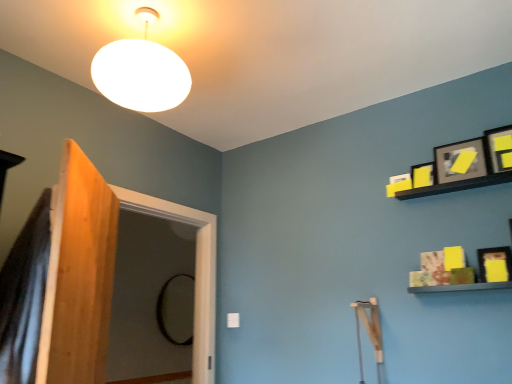
Question: Is matte black picture frame at upper right, which is counted as the 1th picture frame, starting from the top, at the back of matte black picture frame at upper right, the third picture frame in the bottom-to-top sequence?

Choices:
 (A) no
 (B) yes

Answer: (A)

Question: Can you confirm if matte black picture frame at upper right, the third picture frame in the bottom-to-top sequence, is positioned to the left of matte black picture frame at upper right, which is counted as the 1th picture frame, starting from the top?

Choices:
 (A) yes
 (B) no

Answer: (A)

Question: From a real-world perspective, is matte black picture frame at upper right, the third picture frame in the bottom-to-top sequence, under matte black picture frame at upper right, which is counted as the 1th picture frame, starting from the top?

Choices:
 (A) yes
 (B) no

Answer: (A)

Question: Considering the relative sizes of matte black picture frame at upper right, the third picture frame in the bottom-to-top sequence, and matte black picture frame at upper right, placed as the 4th picture frame when sorted from bottom to top, in the image provided, is matte black picture frame at upper right, the third picture frame in the bottom-to-top sequence, smaller than matte black picture frame at upper right, placed as the 4th picture frame when sorted from bottom to top,?

Choices:
 (A) no
 (B) yes

Answer: (A)

Question: Is matte black picture frame at upper right, the third picture frame in the bottom-to-top sequence, closer to the viewer compared to matte black picture frame at upper right, which is counted as the 1th picture frame, starting from the top?

Choices:
 (A) no
 (B) yes

Answer: (A)

Question: Looking at their shapes, would you say black glass mirror at center is wider or thinner than wooden screen door at left?

Choices:
 (A) thin
 (B) wide

Answer: (A)

Question: Is point (160, 317) closer or farther from the camera than point (210, 283)?

Choices:
 (A) farther
 (B) closer

Answer: (A)

Question: Relative to wooden screen door at left, is black glass mirror at center in front or behind?

Choices:
 (A) behind
 (B) front

Answer: (A)

Question: Is black glass mirror at center spatially inside wooden screen door at left, or outside of it?

Choices:
 (A) outside
 (B) inside

Answer: (A)

Question: Considering their positions, is wooden screen door at left located in front of or behind yellow matte picture frame at upper right, positioned as the third picture frame in top-to-bottom order?

Choices:
 (A) behind
 (B) front

Answer: (B)

Question: Is point (206, 292) closer or farther from the camera than point (411, 170)?

Choices:
 (A) closer
 (B) farther

Answer: (B)

Question: Is wooden screen door at left spatially inside yellow matte picture frame at upper right, positioned as the third picture frame in top-to-bottom order, or outside of it?

Choices:
 (A) inside
 (B) outside

Answer: (B)

Question: Would you say wooden screen door at left is to the left or to the right of yellow matte picture frame at upper right, positioned as the third picture frame in top-to-bottom order, in the picture?

Choices:
 (A) left
 (B) right

Answer: (A)

Question: Is yellow matte picture frame at upper right, which ranks as the 2th picture frame in bottom-to-top order, spatially inside black glass mirror at center, or outside of it?

Choices:
 (A) inside
 (B) outside

Answer: (B)

Question: Based on their positions, is yellow matte picture frame at upper right, positioned as the third picture frame in top-to-bottom order, located to the left or right of black glass mirror at center?

Choices:
 (A) left
 (B) right

Answer: (B)